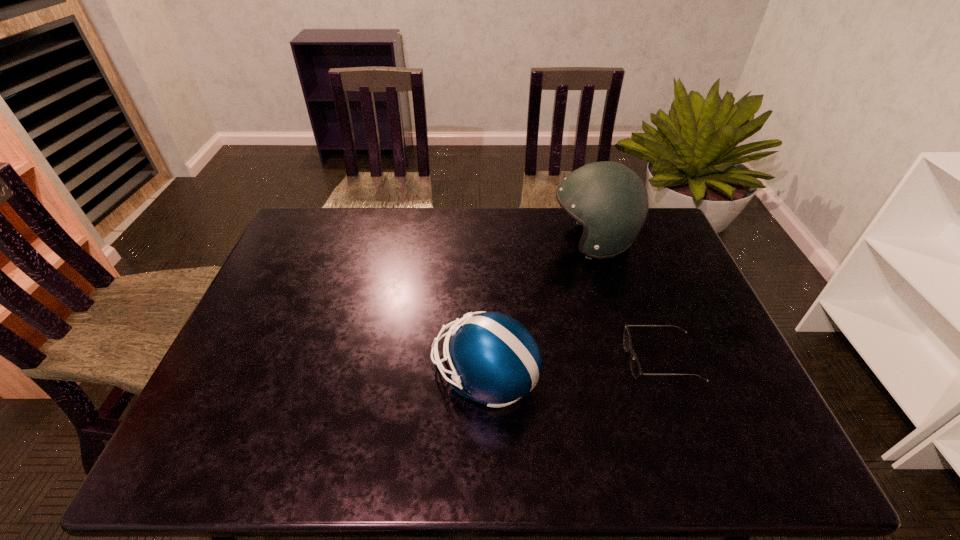
You are a GUI agent. You are given a task and a screenshot of the screen. Output one action in this format:
    pyautogui.click(x=<x>, y=<y>)
    Task: Click on the vacant point at the left edge
    The width and height of the screenshot is (960, 540).
    Given the screenshot: What is the action you would take?
    click(x=221, y=375)

I want to click on free space at the right edge of the desktop, so click(x=679, y=293).

Find the location of a particular element. This screenshot has height=540, width=960. free space at the far left corner of the desktop is located at coordinates (314, 210).

Find the location of a particular element. The width and height of the screenshot is (960, 540). vacant point located between the shortest object and the right football helmet is located at coordinates (627, 301).

The height and width of the screenshot is (540, 960). Find the location of `free space between the taller football helmet and the nearer football helmet`. free space between the taller football helmet and the nearer football helmet is located at coordinates pos(539,308).

The width and height of the screenshot is (960, 540). I want to click on empty space between the shortest object and the shorter football helmet, so click(x=572, y=368).

Locate an element on the screen. empty space between the shortest object and the farthest object is located at coordinates (627, 301).

The image size is (960, 540). In order to click on free point between the farthest object and the left football helmet in this screenshot , I will do `click(539, 308)`.

You are a GUI agent. You are given a task and a screenshot of the screen. Output one action in this format:
    pyautogui.click(x=<x>, y=<y>)
    Task: Click on the empty space between the spectacles and the tallest object
    This screenshot has width=960, height=540.
    Given the screenshot: What is the action you would take?
    coord(627,301)

What are the coordinates of `vacant space that's between the leftmost object and the spectacles` in the screenshot? It's located at (572, 368).